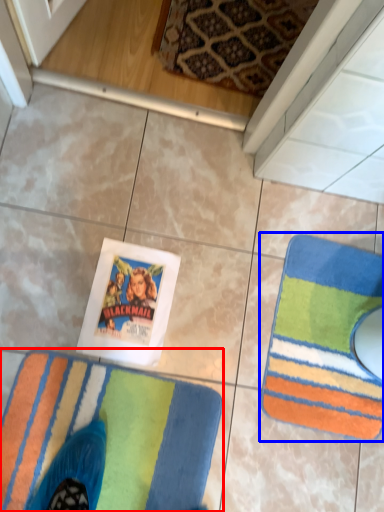
Question: Which point is further to the camera, towel (highlighted by a red box) or towel (highlighted by a blue box)?

Choices:
 (A) towel
 (B) towel

Answer: (B)